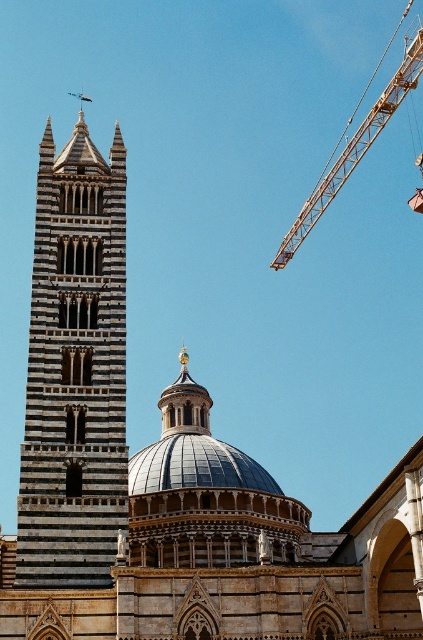
You are an architect analyzing the building structure. Which of the two objects, the striped stone dome at center or the striped stone tower at left, has a smaller width when viewed from above?

The striped stone dome at center is thinner than the striped stone tower at left, so the dome has a smaller width when viewed from above.